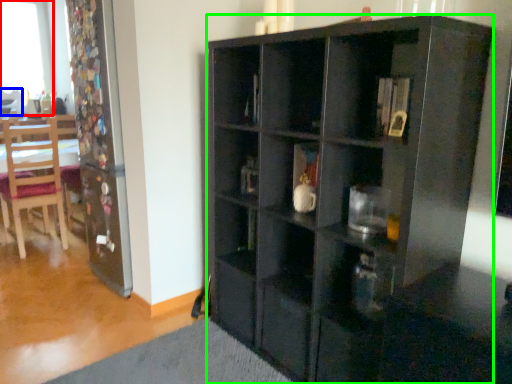
Question: Based on their relative distances, which object is farther from window (highlighted by a red box)? Choose from chair (highlighted by a blue box) and cabinetry (highlighted by a green box).

Choices:
 (A) chair
 (B) cabinetry

Answer: (B)